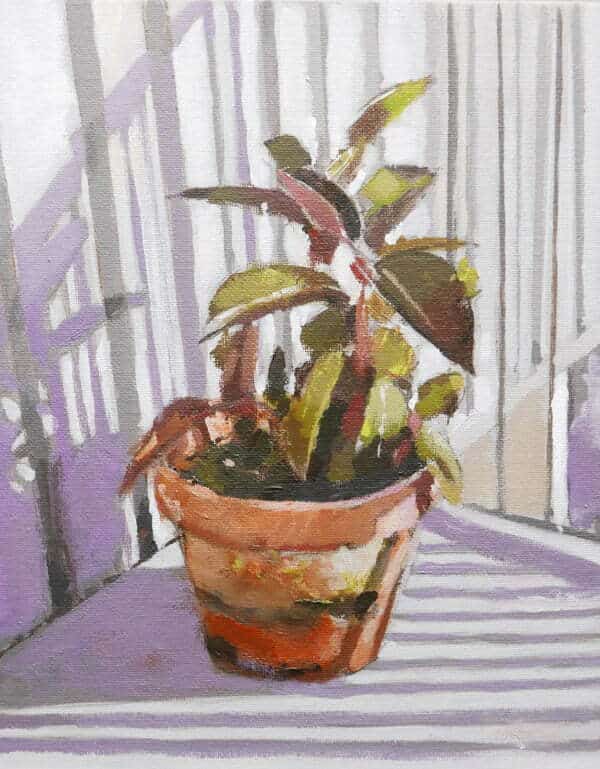
What are the coordinates of `bottom of pot of painted plant` in the screenshot? It's located at (295, 673).